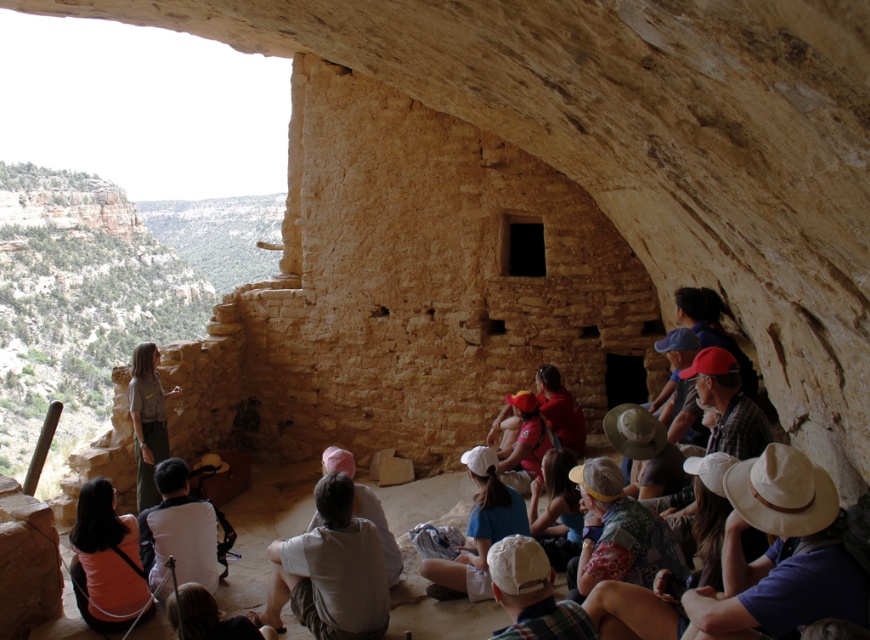
You are standing at the entrance of the cliff dwelling and want to move towards the tour guide who is at point [517,602]. There is another point at [181,500]. Which point is behind the tour guide?

Point [181,500] is behind point [517,602].

You are a tour guide standing at the entrance of the cliff dwelling. You notice a visitor wearing a white cotton shirt at center and another wearing an orange cotton shirt at lower left. If you want to ensure both visitors can hear your presentation clearly, and your voice carries up to 5 meters, will both visitors be within hearing range?

The white cotton shirt at center and orange cotton shirt at lower left are 5.16 meters apart. Since the maximum distance your voice can carry is 5 meters, the visitor wearing the orange cotton shirt at lower left is slightly out of hearing range.

You are part of a tour group visiting the historical cliff dwelling. You notice two people wearing shirts of different colors. The white cotton shirt at center and the orange cotton shirt at lower left. Which shirt is positioned lower in the image?

The white cotton shirt at center is below orange cotton shirt at lower left, so the white cotton shirt at center is positioned lower in the image.